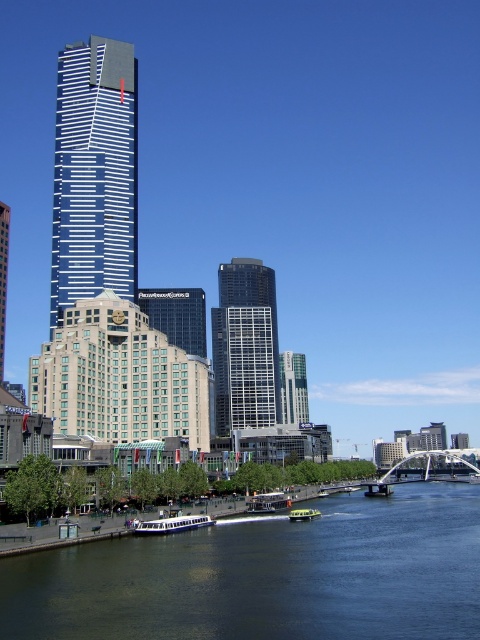
Which is more to the left, glassy steel skyscraper at center or white plastic boat at center?

glassy steel skyscraper at center

Is point (251, 342) farther from camera compared to point (268, 500)?

That is True.

Locate an element on the screen. glassy steel skyscraper at center is located at coordinates (244, 346).

Is point (0, 316) behind point (251, 502)?

Yes, it is.

Is glassy blue skyscraper at center positioned before white plastic boat at center?

No, it is behind white plastic boat at center.

Image resolution: width=480 pixels, height=640 pixels. What do you see at coordinates (2, 278) in the screenshot?
I see `glassy blue skyscraper at center` at bounding box center [2, 278].

Find the location of `glassy blue skyscraper at center`. glassy blue skyscraper at center is located at coordinates (2, 278).

Is metallic silver boat at lower center below green matte boat at center?

No, metallic silver boat at lower center is not below green matte boat at center.

I want to click on metallic silver boat at lower center, so click(x=173, y=524).

Where is `metallic silver boat at lower center`? This screenshot has height=640, width=480. metallic silver boat at lower center is located at coordinates (173, 524).